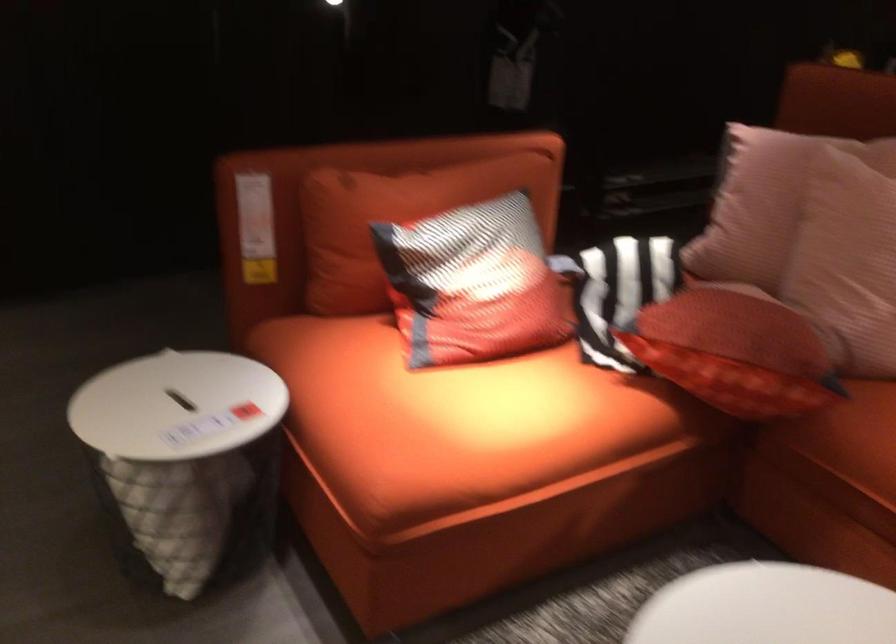
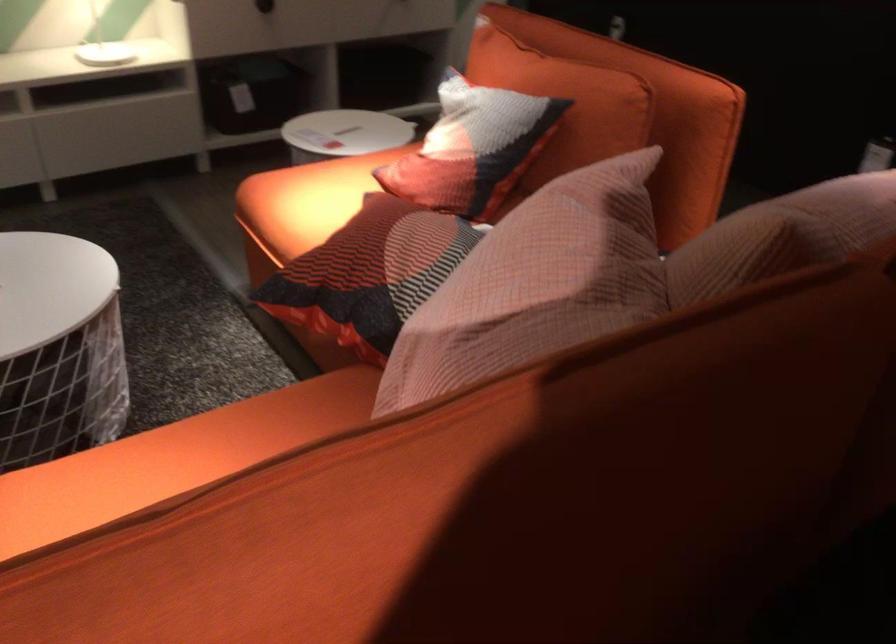
The point at (796,330) is marked in the first image. Where is the corresponding point in the second image?

(369, 274)